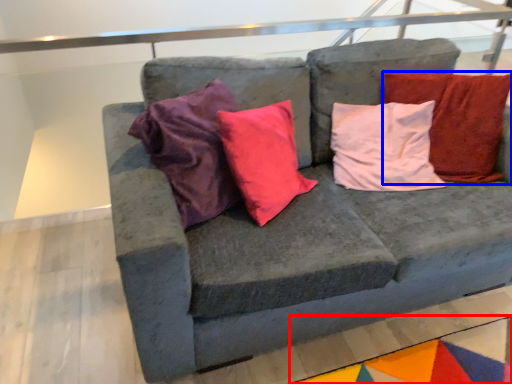
Question: Which object appears closest to the camera in this image, mat (highlighted by a red box) or pillow (highlighted by a blue box)?

Choices:
 (A) mat
 (B) pillow

Answer: (A)